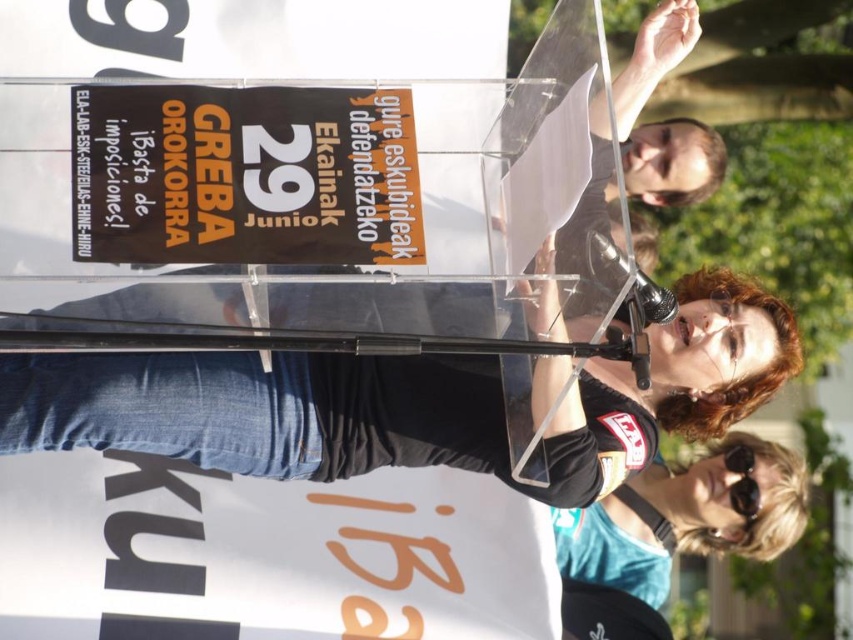
What do you see at coordinates (242, 176) in the screenshot? I see `black paper sign at upper center` at bounding box center [242, 176].

Is black paper sign at upper center thinner than black plastic sunglasses at lower right?

No, black paper sign at upper center is not thinner than black plastic sunglasses at lower right.

Where is `black paper sign at upper center`? black paper sign at upper center is located at coordinates (242, 176).

Between black paper sign at upper center and teal fabric sunglasses at lower right, which one is positioned lower?

teal fabric sunglasses at lower right

Is point (86, 88) farther from camera compared to point (682, 470)?

No, it is in front of (682, 470).

Where is `black paper sign at upper center`? The width and height of the screenshot is (853, 640). black paper sign at upper center is located at coordinates (242, 176).

Could you measure the distance between teal fabric sunglasses at lower right and black plastic sunglasses at lower right?

teal fabric sunglasses at lower right and black plastic sunglasses at lower right are 4.99 inches apart from each other.

Is teal fabric sunglasses at lower right thinner than black plastic sunglasses at lower right?

Incorrect, teal fabric sunglasses at lower right's width is not less than black plastic sunglasses at lower right's.

Is point (737, 538) less distant than point (738, 484)?

No, it is not.

You are a GUI agent. You are given a task and a screenshot of the screen. Output one action in this format:
    pyautogui.click(x=<x>, y=<y>)
    Task: Click on the teal fabric sunglasses at lower right
    The height and width of the screenshot is (640, 853).
    Given the screenshot: What is the action you would take?
    pyautogui.click(x=686, y=516)